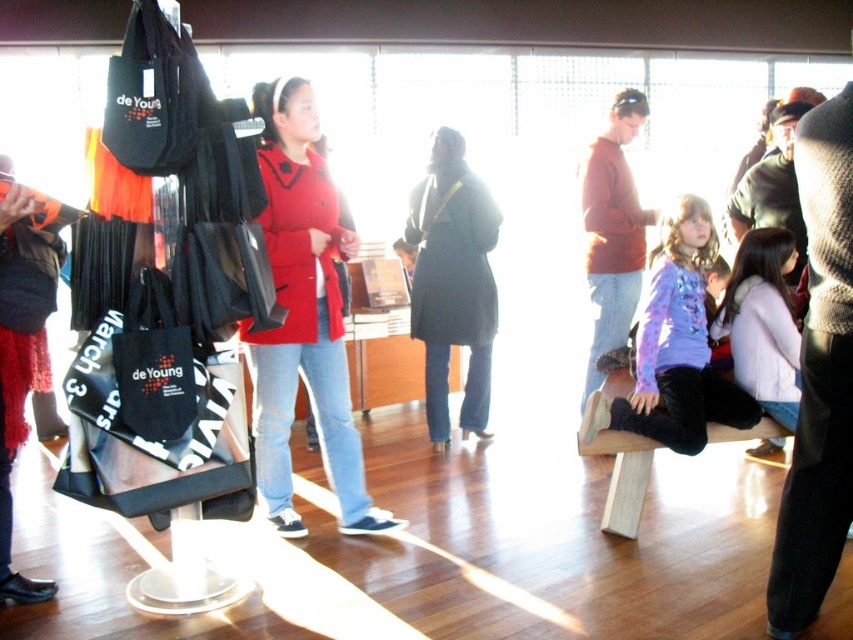
You are an event coordinator at the de Young museum and need to retrieve a black canvas tote at center for a guest. However, there is a purple sweater at center blocking access. Can you easily reach the tote without disturbing the sweater?

The purple sweater at center is located above the black canvas tote at center, so you can easily reach the tote without disturbing the sweater since it is positioned below.

You are an event organizer at the de Young museum and need to place a new promotional item on the display stand. The item is 1.2 meters tall. Can the matte red sweater at center and the black canvas tote at center accommodate this new item in terms of height?

The matte red sweater at center is taller than the black canvas tote at center. Since the new item is 1.2 meters tall, it would need to be placed where the shorter item is. However, without knowing the exact heights of the existing items, it is impossible to determine if the new item will fit. Please check the actual dimensions of the existing items before deciding.

You are standing at the entrance of the gallery and see two points marked on the floor. The first point is at position point (277, 355) and the second point is at position point (434, 406). If you want to walk from the entrance towards the display stand with de Young tote bags, which point should you step on first?

Point (277, 355) is in front of point (434, 406), so you should step on point (277, 355) first when walking towards the display stand with de Young tote bags.